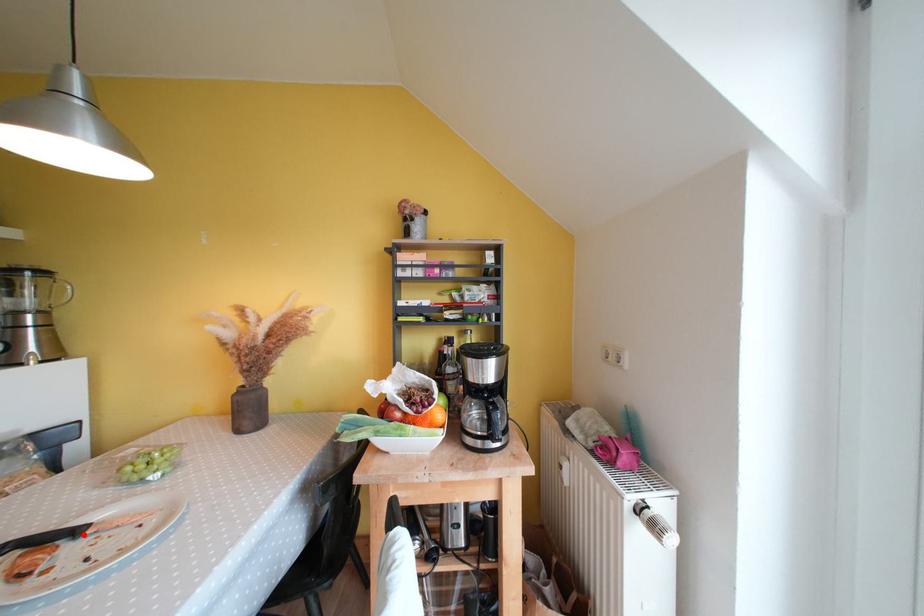
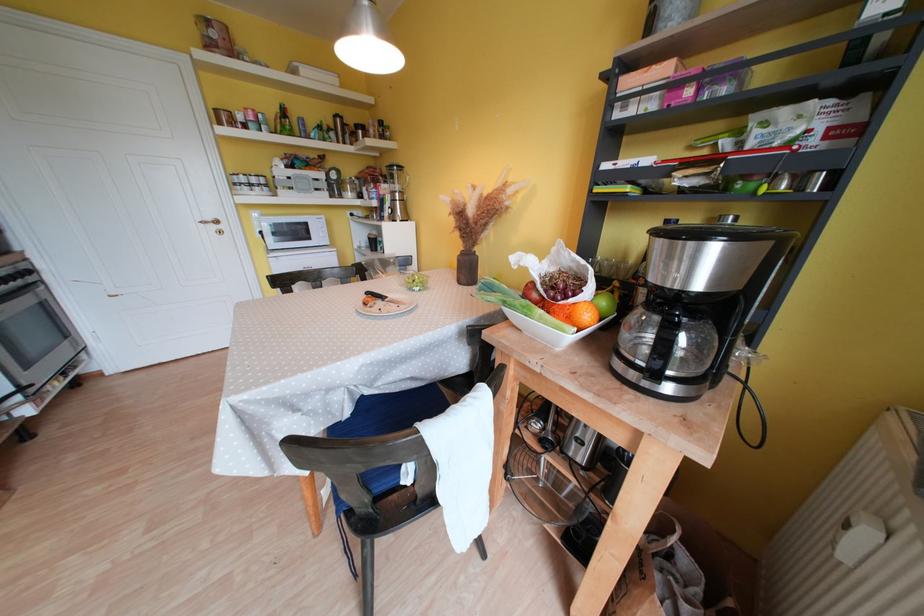
Find the pixel in the second image that matches the highlighted location in the first image.

(390, 301)